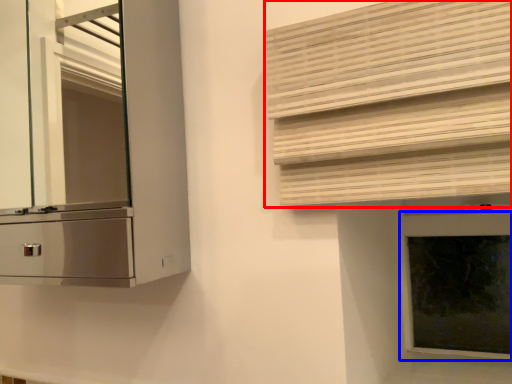
Question: Which object is closer to the camera taking this photo, shutter (highlighted by a red box) or window frame (highlighted by a blue box)?

Choices:
 (A) shutter
 (B) window frame

Answer: (A)